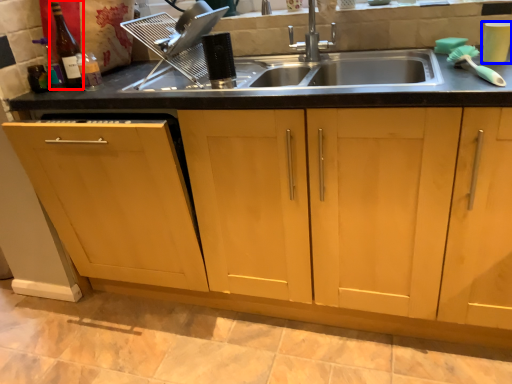
Question: Which object is closer to the camera taking this photo, bottle (highlighted by a red box) or appliance (highlighted by a blue box)?

Choices:
 (A) bottle
 (B) appliance

Answer: (B)